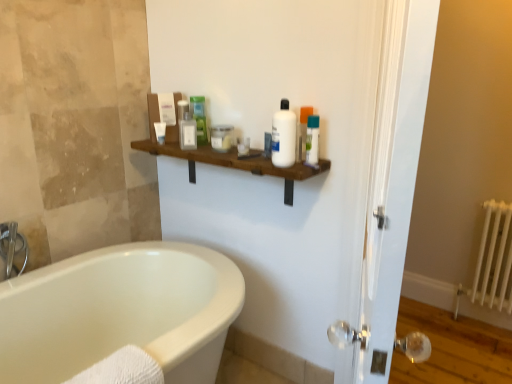
Where is `vacant space to the left of white metal radiator at right`? Image resolution: width=512 pixels, height=384 pixels. vacant space to the left of white metal radiator at right is located at coordinates (444, 330).